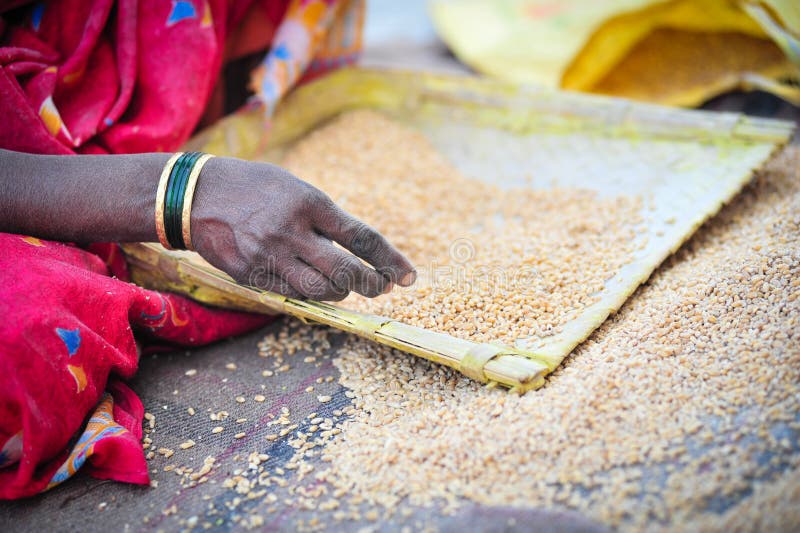
I want to click on yellow edge of tray, so click(x=344, y=94).